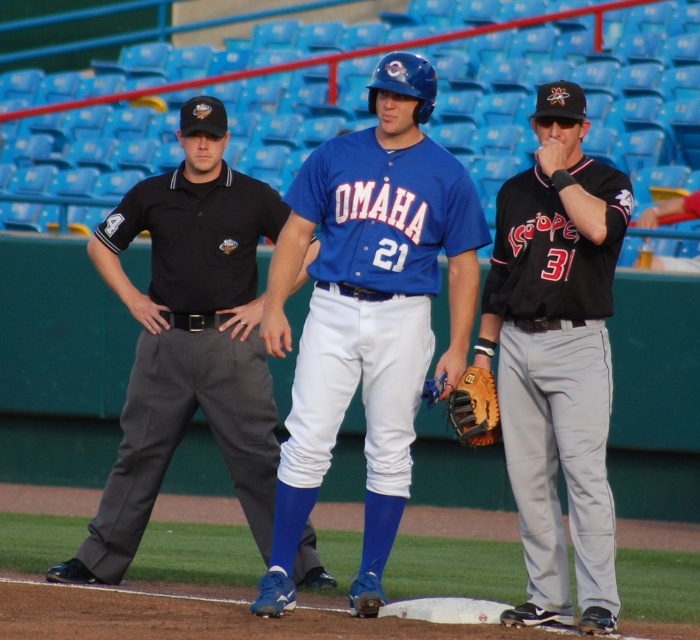
Is black jersey at center shorter than brown leather baseball glove at center?

Incorrect, black jersey at center's height does not fall short of brown leather baseball glove at center's.

Is point (519, 433) closer to viewer compared to point (466, 410)?

No, (519, 433) is further to viewer.

The height and width of the screenshot is (640, 700). Identify the location of black jersey at center. (556, 358).

Between point (252, 216) and point (606, 477), which one is positioned in front?

Positioned in front is point (606, 477).

Based on the photo, is black smooth shirt at center further to camera compared to black jersey at center?

Yes, it is.

Measure the distance between black smooth shirt at center and camera.

12.43 meters

At what (x,y) coordinates should I click in order to perform the action: click on black smooth shirt at center. Please return your answer as a coordinate pair (x, y). Looking at the image, I should click on (188, 340).

Is black smooth shirt at center shorter than brown leather baseball glove at center?

Incorrect, black smooth shirt at center's height does not fall short of brown leather baseball glove at center's.

Where is `black smooth shirt at center`? Image resolution: width=700 pixels, height=640 pixels. black smooth shirt at center is located at coordinates (188, 340).

In order to click on black smooth shirt at center in this screenshot , I will do `click(188, 340)`.